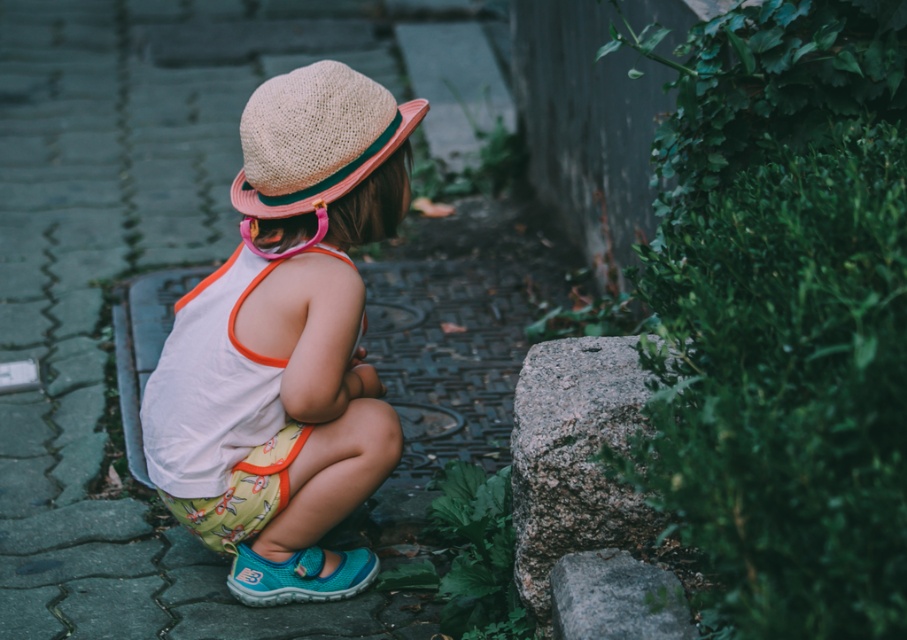
Question: From the image, what is the correct spatial relationship of matte straw hat at center in relation to straw hat at center?

Choices:
 (A) left
 (B) right

Answer: (A)

Question: Estimate the real-world distances between objects in this image. Which object is closer to the gray cobblestone pavement at center?

Choices:
 (A) granite rock at lower right
 (B) straw hat at center

Answer: (A)

Question: Does matte straw hat at center appear over gray rough stone at lower right?

Choices:
 (A) yes
 (B) no

Answer: (A)

Question: Can you confirm if gray cobblestone pavement at center is bigger than granite rock at lower right?

Choices:
 (A) no
 (B) yes

Answer: (B)

Question: Which is nearer to the gray cobblestone pavement at center?

Choices:
 (A) matte straw hat at center
 (B) granite rock at lower right
 (C) gray rough stone at lower right
 (D) straw hat at center

Answer: (A)

Question: Estimate the real-world distances between objects in this image. Which object is farther from the straw hat at center?

Choices:
 (A) granite rock at lower right
 (B) gray rough stone at lower right

Answer: (B)